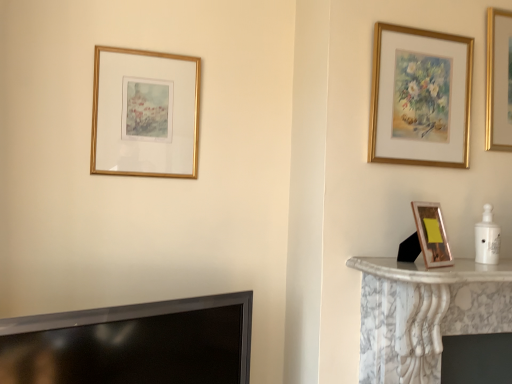
Question: In terms of height, does gold metallic picture frame at right, the second picture frame from the right, look taller or shorter compared to black glossy tv at lower left?

Choices:
 (A) short
 (B) tall

Answer: (A)

Question: Based on their positions, is gold metallic picture frame at right, the 3th picture frame positioned from the back, located to the left or right of black glossy tv at lower left?

Choices:
 (A) right
 (B) left

Answer: (A)

Question: Which of these objects is positioned closest to the gold metallic picture frame at right, which ranks as the 2th picture frame in left-to-right order?

Choices:
 (A) gold-framed picture at upper left, which is the first picture frame in left-to-right order
 (B) gold-framed painting at upper right, which is counted as the 2th picture frame, starting from the front
 (C) black glossy tv at lower left

Answer: (B)

Question: Which object is the closest to the gold-framed picture at upper left, marked as the first picture frame in a back-to-front arrangement?

Choices:
 (A) gold-framed painting at upper right, which is counted as the 2th picture frame, starting from the front
 (B) gold metallic picture frame at right, the second picture frame from the right
 (C) black glossy tv at lower left

Answer: (C)